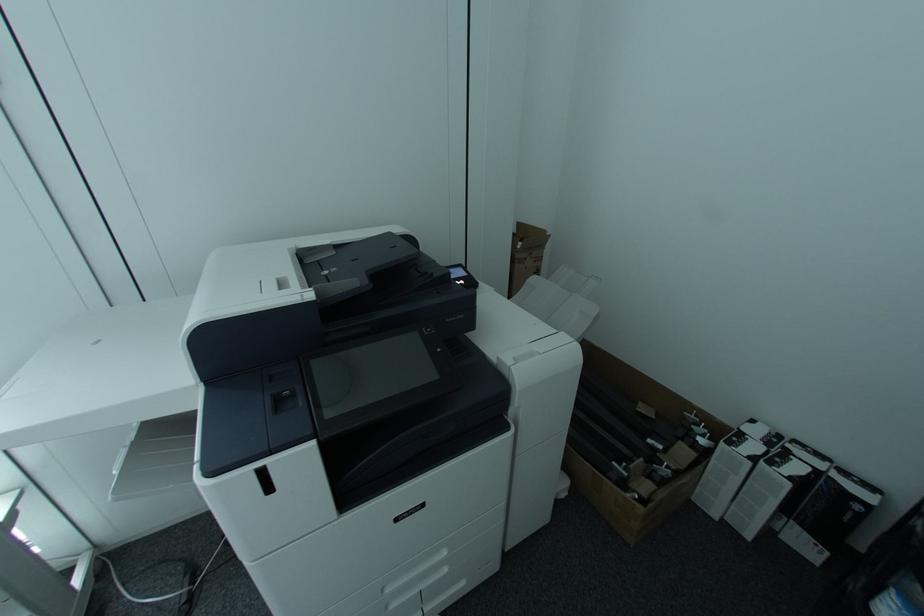
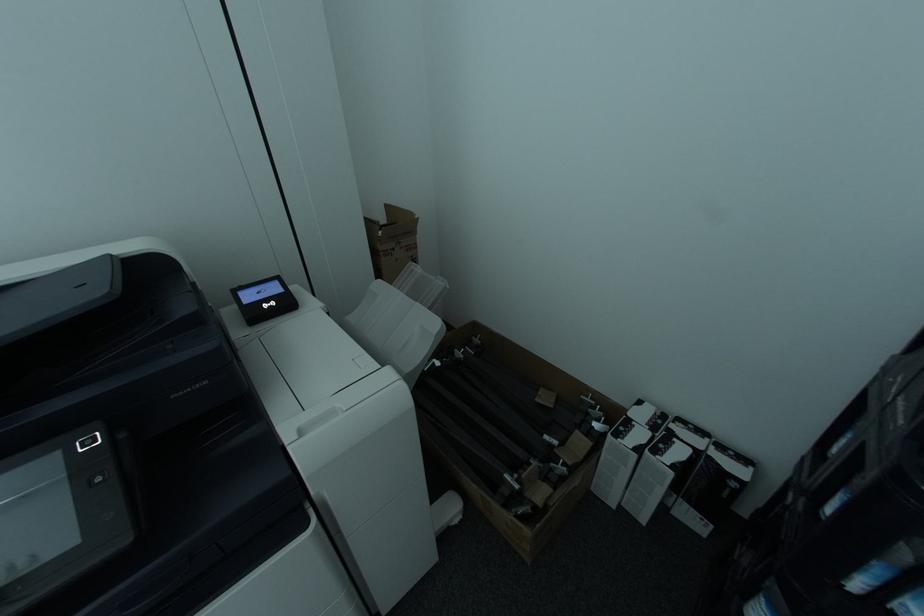
Question: The first image is from the beginning of the video and the second image is from the end. How did the camera likely rotate when shooting the video?

Choices:
 (A) Left
 (B) Right
 (C) Up
 (D) Down

Answer: (B)